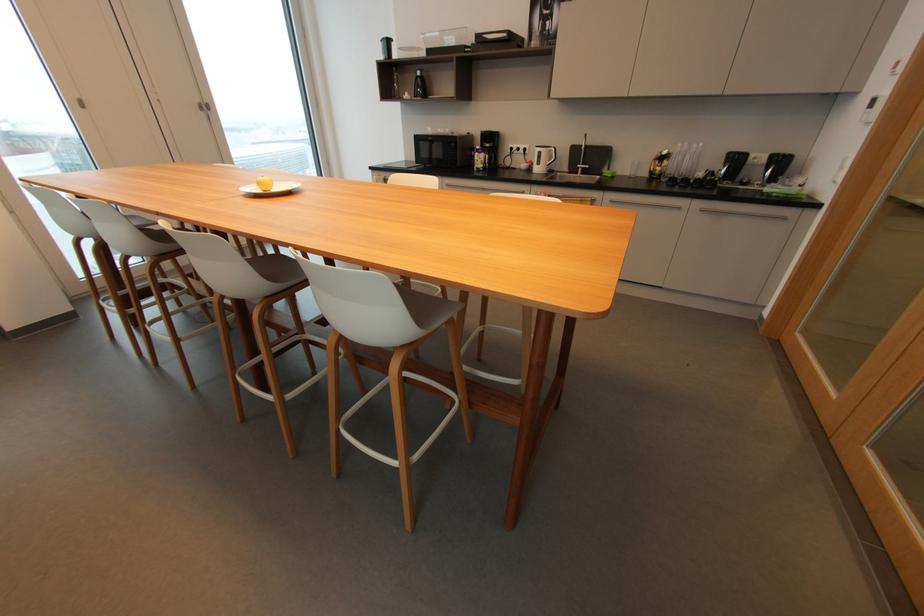
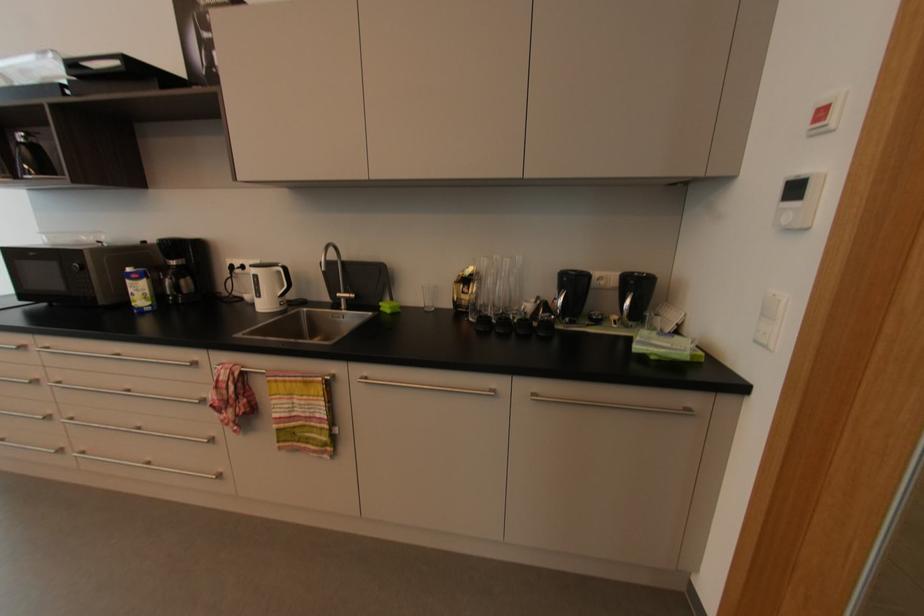
Where in the second image is the point corresponding to (587,169) from the first image?

(350, 300)